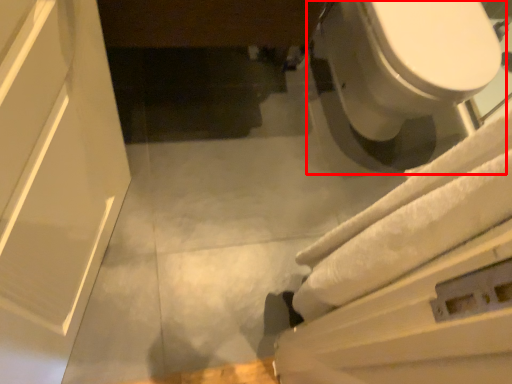
Question: Observing the image, what is the correct spatial positioning of toilet (annotated by the red box) in reference to bath towel?

Choices:
 (A) left
 (B) right

Answer: (B)